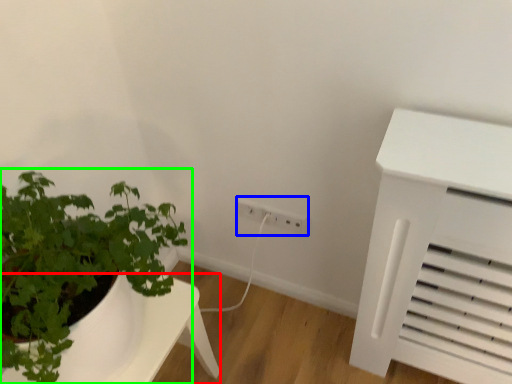
Question: Considering the real-world distances, which object is farthest from table (highlighted by a red box)? electric outlet (highlighted by a blue box) or houseplant (highlighted by a green box)?

Choices:
 (A) electric outlet
 (B) houseplant

Answer: (A)